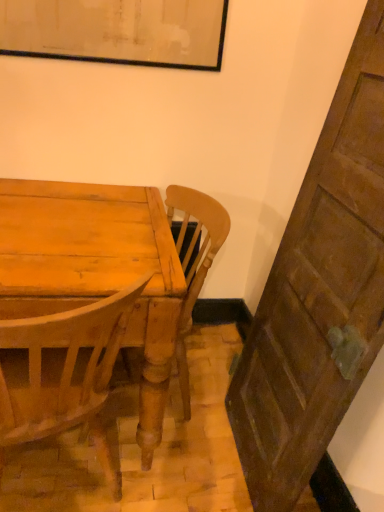
Question: Is the position of wooden chair at center more distant than that of wooden table top at center?

Choices:
 (A) yes
 (B) no

Answer: (A)

Question: Is wooden chair at center shorter than wooden table top at center?

Choices:
 (A) yes
 (B) no

Answer: (B)

Question: Does wooden chair at center have a greater height compared to wooden table top at center?

Choices:
 (A) yes
 (B) no

Answer: (A)

Question: From a real-world perspective, is wooden chair at center over wooden table top at center?

Choices:
 (A) yes
 (B) no

Answer: (A)

Question: From the image's perspective, is wooden chair at center below wooden table top at center?

Choices:
 (A) no
 (B) yes

Answer: (A)

Question: Is there a large distance between wooden chair at center and wooden table top at center?

Choices:
 (A) yes
 (B) no

Answer: (B)

Question: Is wooden chair at center located within wooden table top at center?

Choices:
 (A) yes
 (B) no

Answer: (A)

Question: From a real-world perspective, is wooden table top at center positioned under wooden chair at center based on gravity?

Choices:
 (A) yes
 (B) no

Answer: (A)

Question: Is wooden table top at center taller than wooden chair at center?

Choices:
 (A) yes
 (B) no

Answer: (B)

Question: Is wooden table top at center outside wooden chair at center?

Choices:
 (A) no
 (B) yes

Answer: (A)

Question: Is wooden table top at center directly adjacent to wooden chair at center?

Choices:
 (A) yes
 (B) no

Answer: (B)

Question: Is there a large distance between wooden table top at center and wooden chair at center?

Choices:
 (A) no
 (B) yes

Answer: (A)

Question: From their relative heights in the image, would you say wooden chair at center is taller or shorter than wooden table top at center?

Choices:
 (A) tall
 (B) short

Answer: (A)